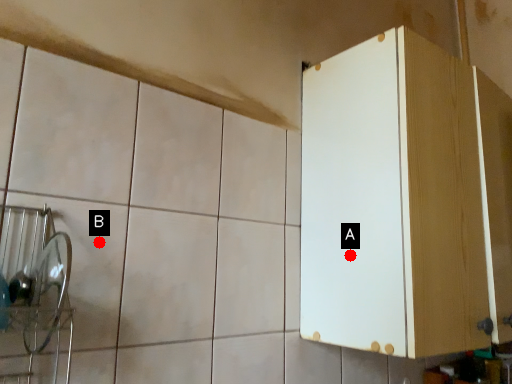
Question: Two points are circled on the image, labeled by A and B beside each circle. Among these points, which one is nearest to the camera?

Choices:
 (A) A is closer
 (B) B is closer

Answer: (B)